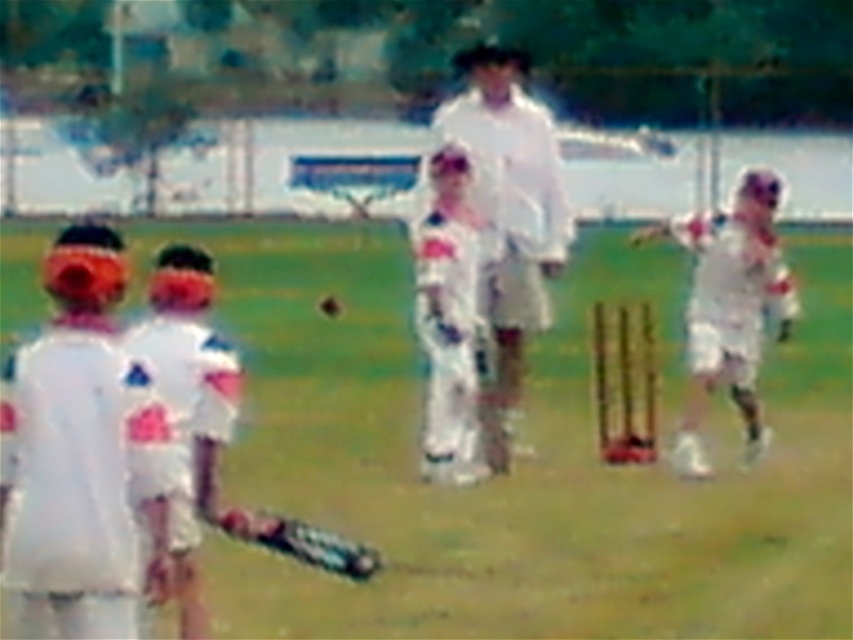
Is white matte cricket bat at left taller than white matte cricket uniform at center?

No.

Who is positioned more to the left, white matte cricket bat at left or white matte cricket uniform at center?

white matte cricket bat at left is more to the left.

Where is `white matte cricket bat at left`? Image resolution: width=853 pixels, height=640 pixels. white matte cricket bat at left is located at coordinates (77, 454).

Does white fabric bat at center have a greater width compared to white matte cricket uniform at center?

Correct, the width of white fabric bat at center exceeds that of white matte cricket uniform at center.

Which is above, white fabric bat at center or white matte cricket uniform at center?

Positioned higher is white matte cricket uniform at center.

Is point (15, 284) in front of point (506, 412)?

No, (15, 284) is behind (506, 412).

Where is `white fabric bat at center`? white fabric bat at center is located at coordinates (517, 460).

In order to click on white fabric bat at center in this screenshot , I will do `click(517, 460)`.

Is white fabric bat at center positioned before white matte cricket bat at left?

No.

Does point (367, 369) lie in front of point (24, 468)?

No, it is not.

Locate an element on the screen. This screenshot has height=640, width=853. white fabric bat at center is located at coordinates (517, 460).